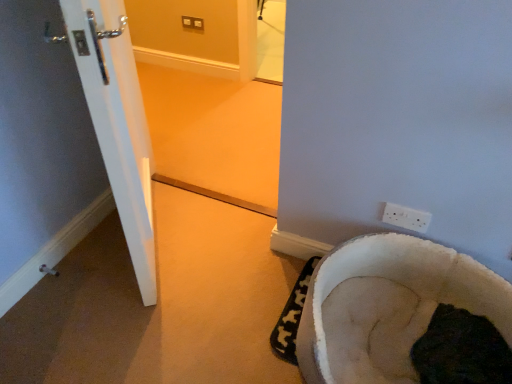
Question: Is dark fur bed at lower right looking in the opposite direction of white plastic electric outlet at lower right?

Choices:
 (A) no
 (B) yes

Answer: (A)

Question: Is dark fur bed at lower right not inside white plastic electric outlet at lower right?

Choices:
 (A) no
 (B) yes

Answer: (B)

Question: Would you say dark fur bed at lower right is a long distance from white plastic electric outlet at lower right?

Choices:
 (A) yes
 (B) no

Answer: (B)

Question: Can you confirm if dark fur bed at lower right is bigger than white plastic electric outlet at lower right?

Choices:
 (A) yes
 (B) no

Answer: (A)

Question: From the image's perspective, is dark fur bed at lower right on top of white plastic electric outlet at lower right?

Choices:
 (A) yes
 (B) no

Answer: (B)

Question: Which is correct: white fluffy pet bed at lower right is inside dark fur bed at lower right, or outside of it?

Choices:
 (A) inside
 (B) outside

Answer: (B)

Question: Looking at their shapes, would you say white fluffy pet bed at lower right is wider or thinner than dark fur bed at lower right?

Choices:
 (A) thin
 (B) wide

Answer: (B)

Question: Looking at the image, does white fluffy pet bed at lower right seem bigger or smaller compared to dark fur bed at lower right?

Choices:
 (A) big
 (B) small

Answer: (A)

Question: Is point coord(354,374) closer or farther from the camera than point coord(457,324)?

Choices:
 (A) closer
 (B) farther

Answer: (A)

Question: Considering the positions of white plastic electric outlet at lower right and white glossy door at lower left in the image, is white plastic electric outlet at lower right wider or thinner than white glossy door at lower left?

Choices:
 (A) wide
 (B) thin

Answer: (B)

Question: Relative to white glossy door at lower left, is white plastic electric outlet at lower right in front or behind?

Choices:
 (A) front
 (B) behind

Answer: (A)

Question: Looking at the image, does white plastic electric outlet at lower right seem bigger or smaller compared to white glossy door at lower left?

Choices:
 (A) small
 (B) big

Answer: (A)

Question: Do you think white plastic electric outlet at lower right is within white glossy door at lower left, or outside of it?

Choices:
 (A) inside
 (B) outside

Answer: (B)

Question: Considering the positions of dark fur bed at lower right and white fluffy pet bed at lower right in the image, is dark fur bed at lower right bigger or smaller than white fluffy pet bed at lower right?

Choices:
 (A) big
 (B) small

Answer: (B)

Question: Is dark fur bed at lower right taller or shorter than white fluffy pet bed at lower right?

Choices:
 (A) short
 (B) tall

Answer: (B)